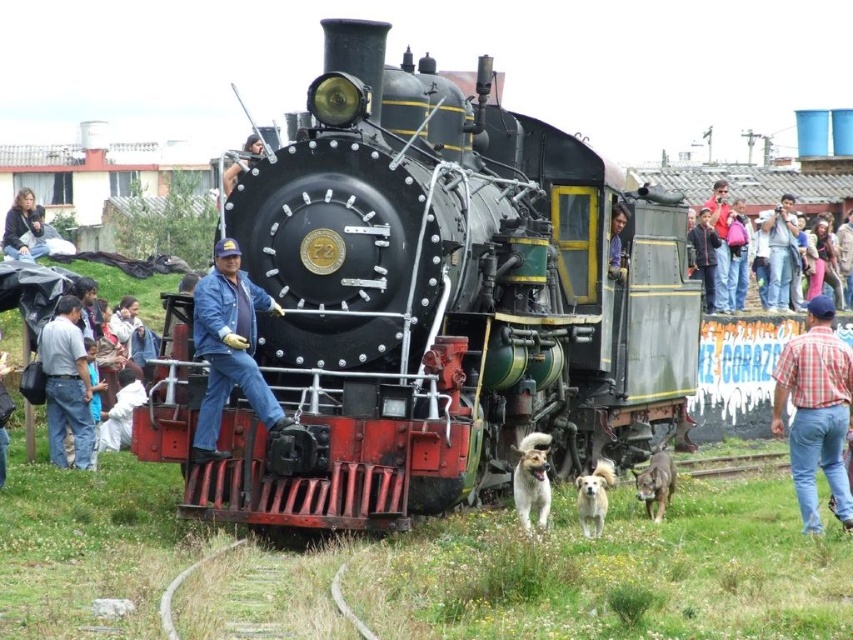
Question: Does polished black locomotive at center have a greater width compared to brown furry dog at center?

Choices:
 (A) no
 (B) yes

Answer: (B)

Question: Is blue denim jeans at center further to the viewer compared to blue denim shirt at center?

Choices:
 (A) yes
 (B) no

Answer: (B)

Question: Is dark blue denim jacket at lower left smaller than blue denim shirt at center?

Choices:
 (A) yes
 (B) no

Answer: (B)

Question: Which of these objects is positioned closest to the blue denim shirt at center?

Choices:
 (A) denim jeans at lower left
 (B) plaid shirt at lower right
 (C) denim jacket at upper right

Answer: (B)

Question: Which of the following is the farthest from the observer?

Choices:
 (A) golden fur dog at lower center
 (B) brushed metal cap at center
 (C) blue denim shirt at center
 (D) denim jacket at upper right

Answer: (D)

Question: Which object is farther from the camera taking this photo?

Choices:
 (A) dark blue denim jacket at lower left
 (B) denim jeans at lower left

Answer: (A)